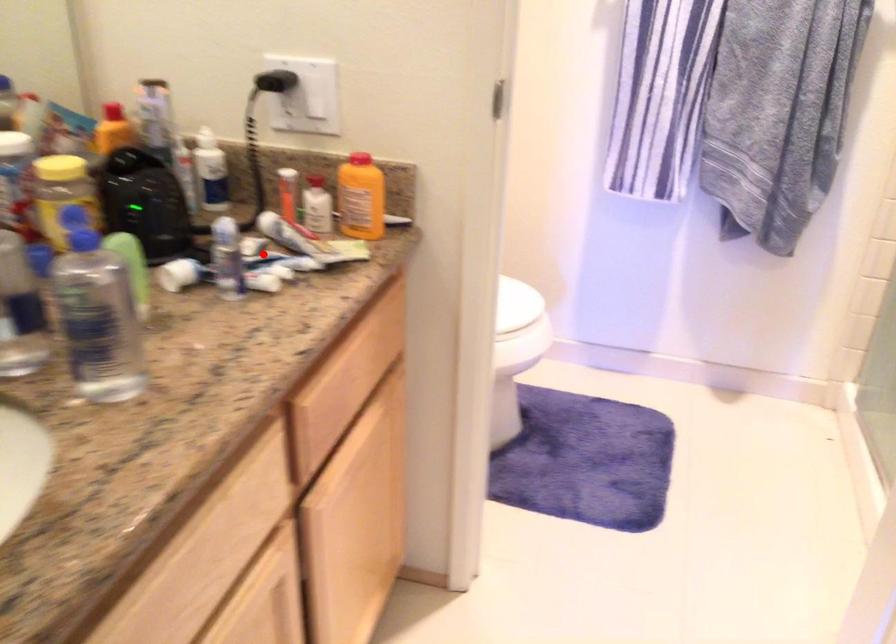
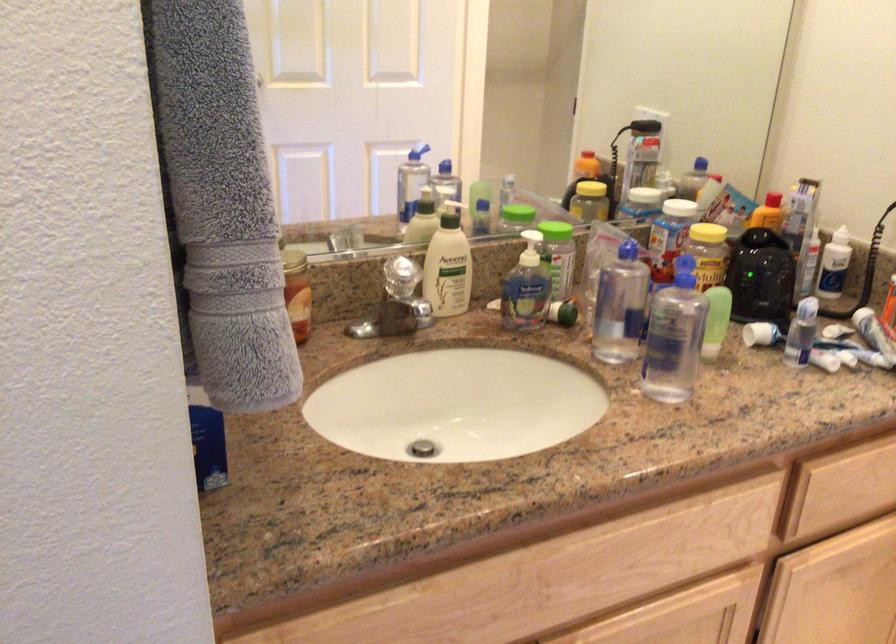
Question: I am providing you with two images of the same scene from different viewpoints. Image1 has a red point marked. In image2, the corresponding 3D location appears at what relative position? Reply with the corresponding letter.

Choices:
 (A) Closer
 (B) Farther

Answer: (B)